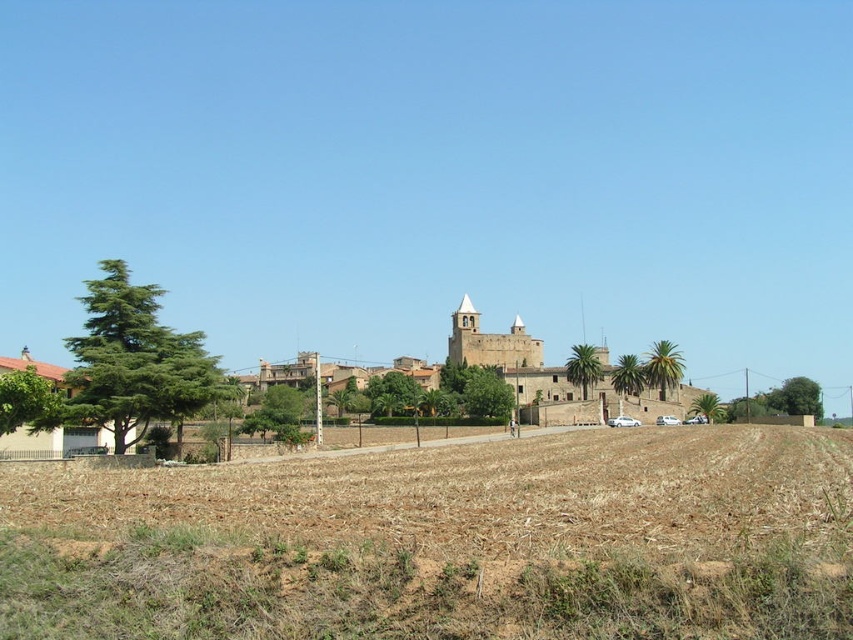
Question: Which point is farther to the camera?

Choices:
 (A) (27, 465)
 (B) (16, 436)

Answer: (B)

Question: From the image, what is the correct spatial relationship of brown soil at lower center in relation to brown stone town at center?

Choices:
 (A) below
 (B) above

Answer: (A)

Question: Which object appears farthest from the camera in this image?

Choices:
 (A) brown stone town at center
 (B) brown soil at lower center

Answer: (A)

Question: Among these points, which one is farthest from the camera?

Choices:
 (A) (555, 385)
 (B) (457, 556)

Answer: (A)

Question: Is the position of brown soil at lower center more distant than that of brown stone town at center?

Choices:
 (A) no
 (B) yes

Answer: (A)

Question: Does brown soil at lower center come behind brown stone town at center?

Choices:
 (A) yes
 (B) no

Answer: (B)